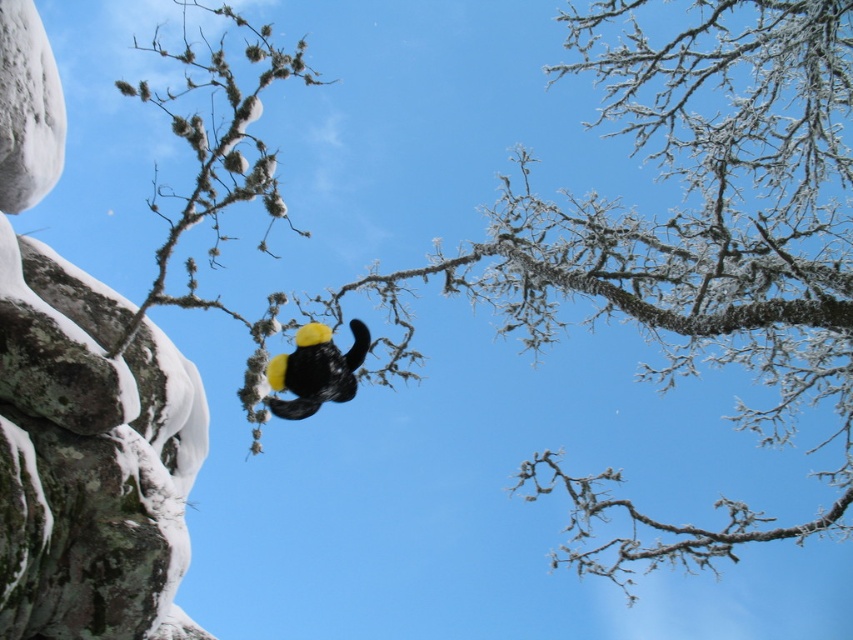
You are standing at the base of the tree and want to hang a decoration between the two points labeled point [637,134] and point [283,412]. Which point is closer to you?

Point [283,412] is closer to you because it is in front of point [637,134].

While observing the winter scene, you notice the frosted branches at center and the yellow matte hat at center. Which object appears wider in the image?

The frosted branches at center appears wider than the yellow matte hat at center.

You are an observer standing in the winter scene. You see the frosted branches at center and the yellow matte hat at center. Which object is positioned to the right side of the other?

The frosted branches at center is to the right of yellow matte hat at center.